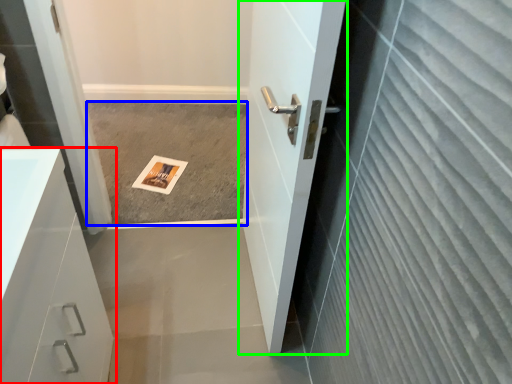
Question: Which is nearer to the bathroom cabinet (highlighted by a red box)? concrete (highlighted by a blue box) or door (highlighted by a green box).

Choices:
 (A) concrete
 (B) door

Answer: (B)